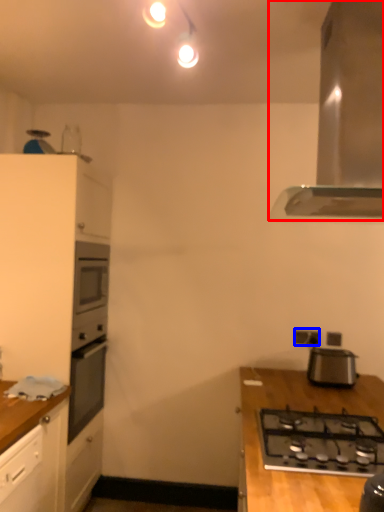
Question: Which point is further to the camera, home appliance (highlighted by a red box) or electric outlet (highlighted by a blue box)?

Choices:
 (A) home appliance
 (B) electric outlet

Answer: (B)